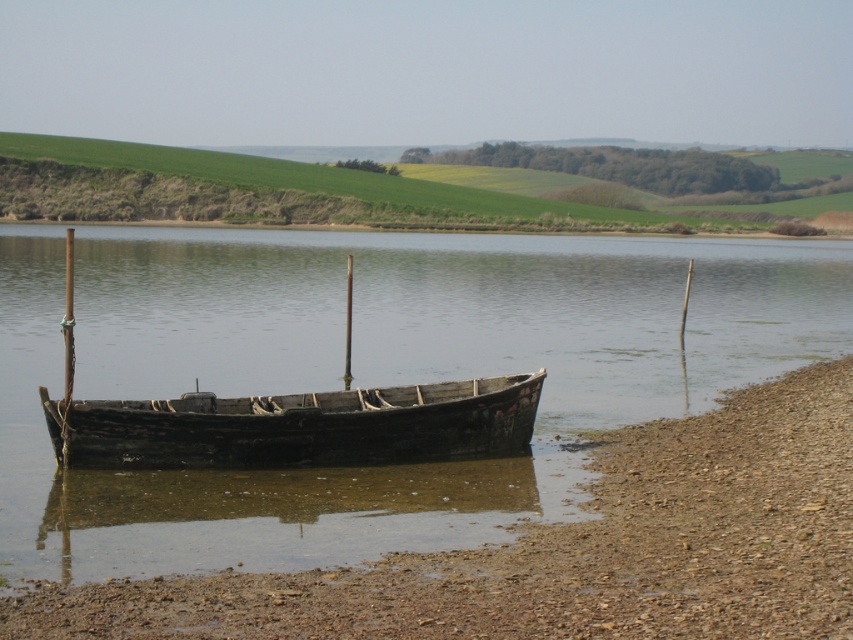
Question: Which of the following is the closest to the observer?

Choices:
 (A) brown wooden boat at center
 (B) dark brown wooden canoe at center

Answer: (A)

Question: Can you confirm if brown wooden boat at center is smaller than rusty wood boat at center?

Choices:
 (A) no
 (B) yes

Answer: (A)

Question: Which point is farther to the camera?

Choices:
 (A) (97, 403)
 (B) (570, 429)

Answer: (B)

Question: From the image, what is the correct spatial relationship of brown wooden boat at center in relation to rusty wood boat at center?

Choices:
 (A) left
 (B) right

Answer: (B)

Question: Does brown wooden boat at center appear on the left side of rusty wood boat at center?

Choices:
 (A) yes
 (B) no

Answer: (B)

Question: Which object is positioned farthest from the brown wooden boat at center?

Choices:
 (A) rusty wood boat at center
 (B) dark brown wooden canoe at center

Answer: (B)